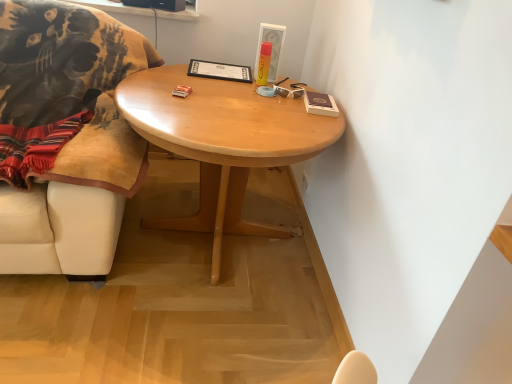
Question: Should I look upward or downward to see velvet beige chair at left?

Choices:
 (A) up
 (B) down

Answer: (A)

Question: Can matte white picture frame at upper center be found inside white plastic sunglasses at upper right?

Choices:
 (A) no
 (B) yes

Answer: (A)

Question: Is white plastic sunglasses at upper right behind matte white picture frame at upper center?

Choices:
 (A) yes
 (B) no

Answer: (B)

Question: Does white plastic sunglasses at upper right have a smaller size compared to matte white picture frame at upper center?

Choices:
 (A) no
 (B) yes

Answer: (B)

Question: Does white plastic sunglasses at upper right appear on the right side of matte white picture frame at upper center?

Choices:
 (A) yes
 (B) no

Answer: (A)

Question: Is white plastic sunglasses at upper right not near matte white picture frame at upper center?

Choices:
 (A) yes
 (B) no

Answer: (B)

Question: Is white plastic sunglasses at upper right bigger than matte white picture frame at upper center?

Choices:
 (A) no
 (B) yes

Answer: (A)

Question: Is white plastic sunglasses at upper right outside velvet beige chair at left?

Choices:
 (A) yes
 (B) no

Answer: (A)

Question: Could you tell me if white plastic sunglasses at upper right is facing velvet beige chair at left?

Choices:
 (A) yes
 (B) no

Answer: (B)

Question: Is white plastic sunglasses at upper right wider than velvet beige chair at left?

Choices:
 (A) yes
 (B) no

Answer: (B)

Question: Is white plastic sunglasses at upper right shorter than velvet beige chair at left?

Choices:
 (A) yes
 (B) no

Answer: (A)

Question: Is white plastic sunglasses at upper right further to the viewer compared to velvet beige chair at left?

Choices:
 (A) no
 (B) yes

Answer: (B)

Question: From a real-world perspective, is white plastic sunglasses at upper right physically below velvet beige chair at left?

Choices:
 (A) yes
 (B) no

Answer: (B)

Question: Is light wood/finish coffee table at center to the right of white plastic sunglasses at upper right from the viewer's perspective?

Choices:
 (A) yes
 (B) no

Answer: (B)